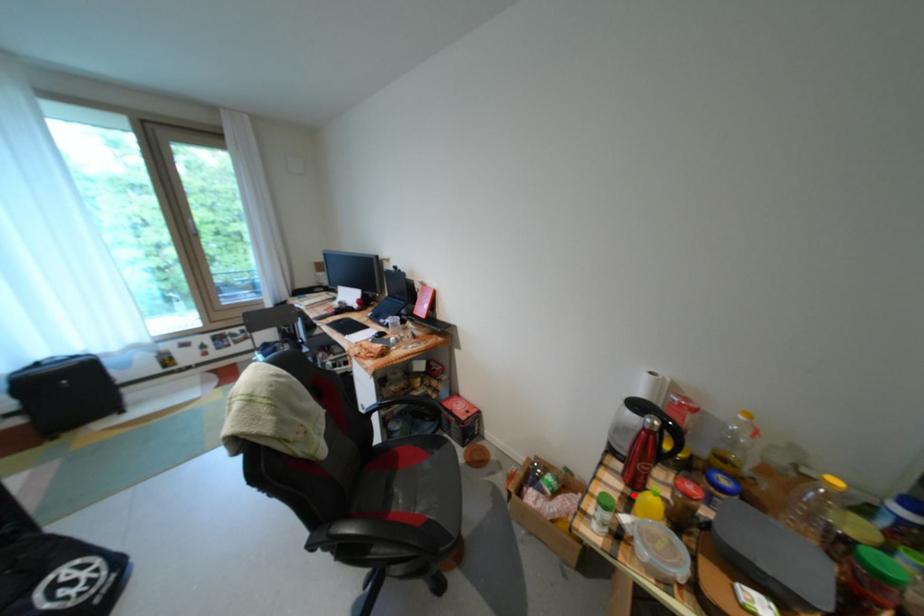
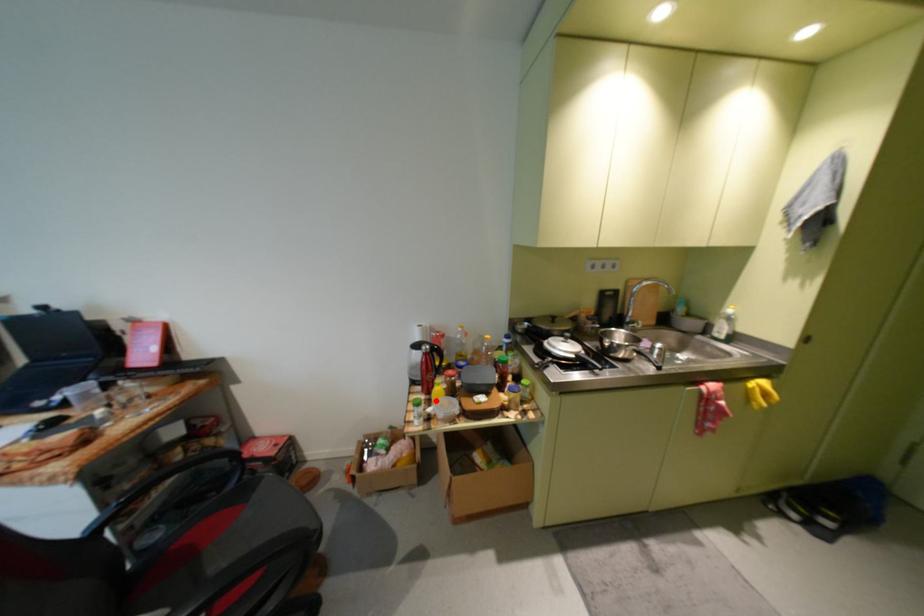
I am providing you with two images of the same scene from different viewpoints. A red point is marked on the first image and another point is marked on the second image. Do the highlighted points in image1 and image2 indicate the same real-world spot?

Yes